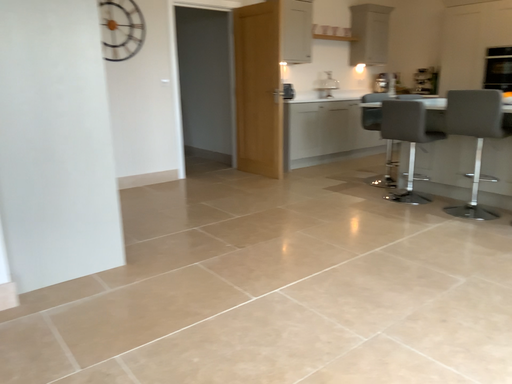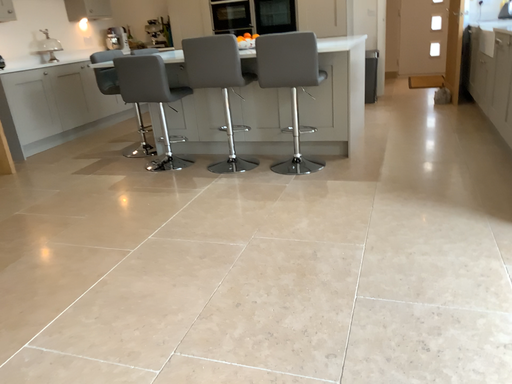
Question: Which way did the camera rotate in the video?

Choices:
 (A) rotated right
 (B) rotated left

Answer: (A)